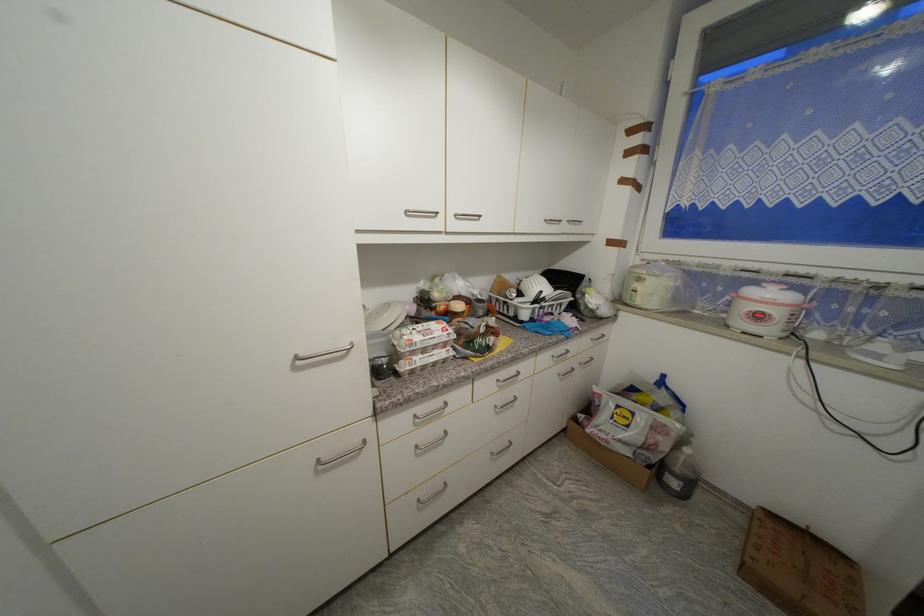
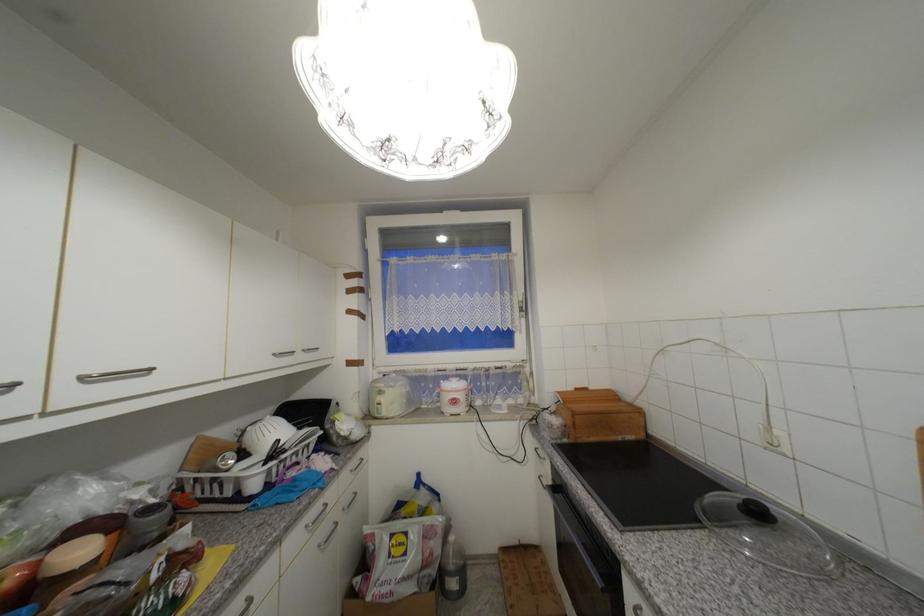
The point at (645, 281) is marked in the first image. Where is the corresponding point in the second image?

(386, 394)